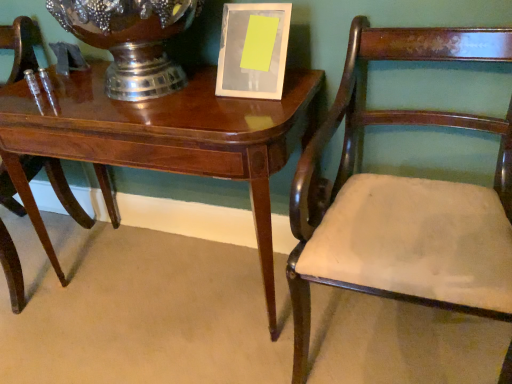
Question: Is mahogany wood chair at right, the 2th chair viewed from the left, in front of brushed metal vase at upper center?

Choices:
 (A) no
 (B) yes

Answer: (B)

Question: Does mahogany wood chair at right, positioned as the first chair in right-to-left order, have a larger size compared to brushed metal vase at upper center?

Choices:
 (A) yes
 (B) no

Answer: (A)

Question: Does mahogany wood chair at right, positioned as the first chair in right-to-left order, appear on the left side of brushed metal vase at upper center?

Choices:
 (A) yes
 (B) no

Answer: (B)

Question: From the image's perspective, is mahogany wood chair at right, positioned as the first chair in right-to-left order, beneath brushed metal vase at upper center?

Choices:
 (A) no
 (B) yes

Answer: (B)

Question: Is mahogany wood chair at right, the 2th chair viewed from the left, facing away from brushed metal vase at upper center?

Choices:
 (A) no
 (B) yes

Answer: (A)

Question: Would you say mahogany wood chair at left, the second chair positioned from the right, is to the left or to the right of mahogany wood chair at right, positioned as the first chair in right-to-left order, in the picture?

Choices:
 (A) left
 (B) right

Answer: (A)

Question: In terms of height, does mahogany wood chair at left, the second chair positioned from the right, look taller or shorter compared to mahogany wood chair at right, positioned as the first chair in right-to-left order?

Choices:
 (A) short
 (B) tall

Answer: (A)

Question: From a real-world perspective, relative to mahogany wood chair at right, positioned as the first chair in right-to-left order, is mahogany wood chair at left, the second chair positioned from the right, vertically above or below?

Choices:
 (A) below
 (B) above

Answer: (A)

Question: Would you say mahogany wood chair at left, the first chair viewed from the left, is inside or outside mahogany wood chair at right, the 2th chair viewed from the left?

Choices:
 (A) outside
 (B) inside

Answer: (A)

Question: Looking at their shapes, would you say brushed metal vase at upper center is wider or thinner than glossy wood table at center?

Choices:
 (A) wide
 (B) thin

Answer: (B)

Question: Considering the positions of point (158, 94) and point (57, 120), is point (158, 94) closer or farther from the camera than point (57, 120)?

Choices:
 (A) closer
 (B) farther

Answer: (B)

Question: Is brushed metal vase at upper center taller or shorter than glossy wood table at center?

Choices:
 (A) short
 (B) tall

Answer: (A)

Question: Which is correct: brushed metal vase at upper center is inside glossy wood table at center, or outside of it?

Choices:
 (A) outside
 (B) inside

Answer: (A)

Question: From a real-world perspective, is mahogany wood chair at left, the second chair positioned from the right, positioned above or below white glossy picture frame at upper center?

Choices:
 (A) above
 (B) below

Answer: (B)

Question: Which is correct: mahogany wood chair at left, the first chair viewed from the left, is inside white glossy picture frame at upper center, or outside of it?

Choices:
 (A) inside
 (B) outside

Answer: (B)